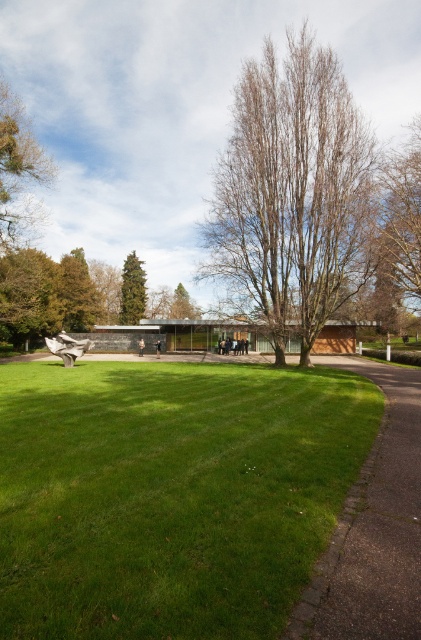
How far apart are paved stone path at lower right and green leafy tree at upper left?

paved stone path at lower right and green leafy tree at upper left are 101.38 feet apart.

Who is lower down, paved stone path at lower right or green leafy tree at upper left?

paved stone path at lower right is below.

I want to click on paved stone path at lower right, so click(x=373, y=531).

Does bare wood tree at center come behind green matte tree at center-left?

No, bare wood tree at center is closer to the viewer.

Who is taller, bare wood tree at center or green matte tree at center-left?

With more height is bare wood tree at center.

Measure the distance between point [207,232] and camera.

Point [207,232] and camera are 31.72 meters apart from each other.

Find the location of `bare wood tree at center`. bare wood tree at center is located at coordinates (293, 193).

Who is positioned more to the right, green grassy at center or green leafy tree at upper left?

Positioned to the right is green grassy at center.

Who is higher up, green grassy at center or green leafy tree at upper left?

green leafy tree at upper left

What do you see at coordinates (170, 493) in the screenshot?
I see `green grassy at center` at bounding box center [170, 493].

The height and width of the screenshot is (640, 421). I want to click on green grassy at center, so click(170, 493).